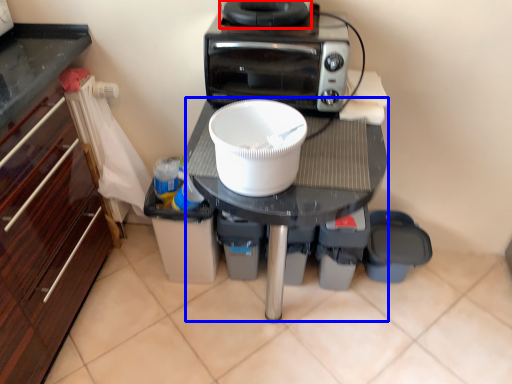
Question: Among these objects, which one is nearest to the camera, appliance (highlighted by a red box) or table (highlighted by a blue box)?

Choices:
 (A) appliance
 (B) table

Answer: (B)